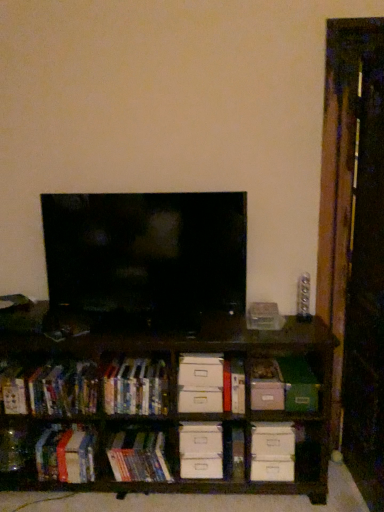
Question: In the image, is hardcover books at center, the fourth book when ordered from left to right, on the left side or the right side of brown wooden shelf at center?

Choices:
 (A) right
 (B) left

Answer: (B)

Question: Looking at the image, does hardcover books at center, the fourth book when ordered from left to right, seem bigger or smaller compared to brown wooden shelf at center?

Choices:
 (A) small
 (B) big

Answer: (A)

Question: Which object is the farthest from the matte black tv at center?

Choices:
 (A) hardcover books at left, acting as the 3th book starting from the left
 (B) hardcover books at center, the fourth book when ordered from left to right
 (C) green matte paper at center-right
 (D) hardcover book at lower left, which appears as the fourth book when viewed from the right
 (E) white cardboard drawer at center, which is the 1th drawer in top-to-bottom order

Answer: (D)

Question: Estimate the real-world distances between objects in this image. Which object is farther from the matte black tv at center?

Choices:
 (A) hardcover book at lower left, arranged as the first book when viewed from the left
 (B) hardcover books at center, the fourth book when ordered from left to right
 (C) hardcover books at center, which ranks as the 5th book in left-to-right order
 (D) white cardboard drawer at center, which is the 2th drawer from top to bottom
 (E) hardcover books at left, which is counted as the 3th book, starting from the right

Answer: (C)